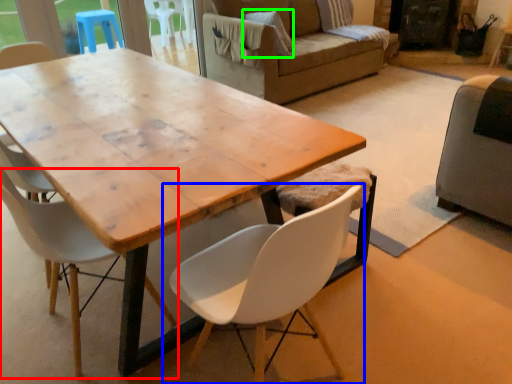
Question: Considering the real-world distances, which object is closest to chair (highlighted by a red box)? chair (highlighted by a blue box) or pillow (highlighted by a green box).

Choices:
 (A) chair
 (B) pillow

Answer: (A)